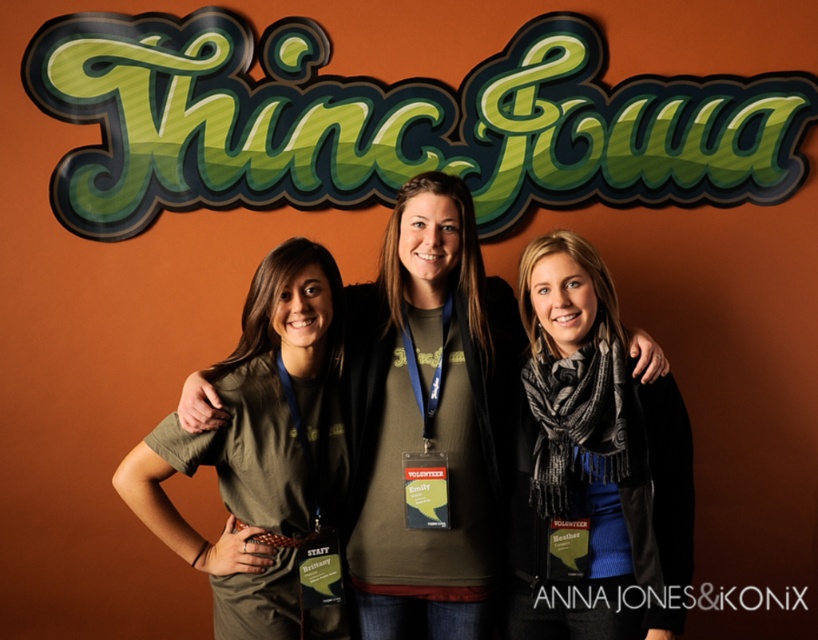
Is matte olive green t-shirt at center taller than black textured scarf at center?

Indeed, matte olive green t-shirt at center has a greater height compared to black textured scarf at center.

Describe the element at coordinates (429, 413) in the screenshot. I see `matte olive green t-shirt at center` at that location.

This screenshot has height=640, width=818. What do you see at coordinates (429, 413) in the screenshot?
I see `matte olive green t-shirt at center` at bounding box center [429, 413].

You are a GUI agent. You are given a task and a screenshot of the screen. Output one action in this format:
    pyautogui.click(x=<x>, y=<y>)
    Task: Click on the matte olive green t-shirt at center
    
    Given the screenshot: What is the action you would take?
    pyautogui.click(x=429, y=413)

Is point (421, 273) closer to viewer compared to point (313, 269)?

That is False.

Who is positioned more to the right, matte olive green t-shirt at center or matte olive green shirt at center?

From the viewer's perspective, matte olive green t-shirt at center appears more on the right side.

Between point (207, 422) and point (218, 611), which one is positioned behind?

The point (218, 611) is more distant.

Find the location of `matte olive green t-shirt at center`. matte olive green t-shirt at center is located at coordinates (429, 413).

Can you confirm if black textured scarf at center is positioned below matte olive green shirt at center?

Indeed, black textured scarf at center is positioned under matte olive green shirt at center.

The width and height of the screenshot is (818, 640). Describe the element at coordinates (592, 465) in the screenshot. I see `black textured scarf at center` at that location.

Locate an element on the screen. This screenshot has height=640, width=818. black textured scarf at center is located at coordinates (592, 465).